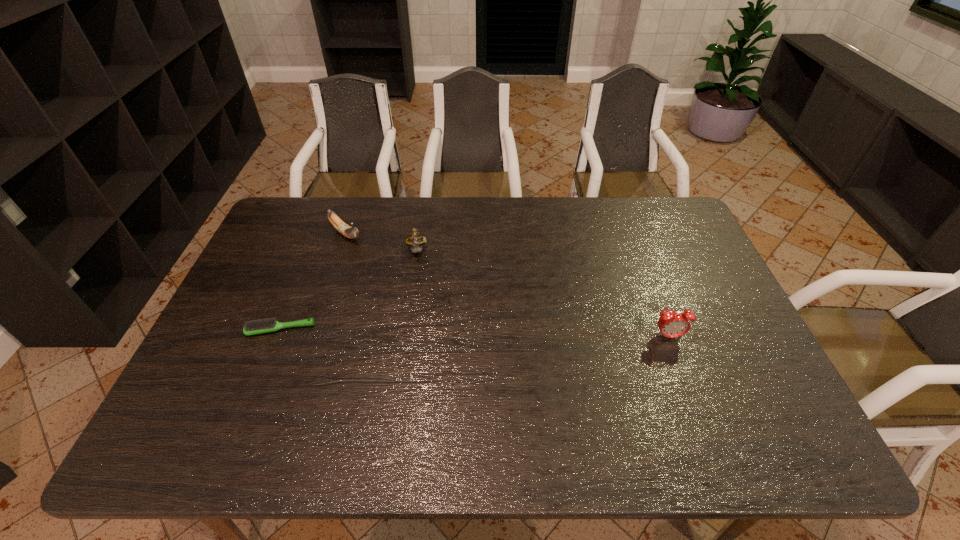
Image resolution: width=960 pixels, height=540 pixels. In order to click on free space on the desktop that is between the shortest object and the rightmost object and is positioned on the face of the third object from left to right in this screenshot , I will do `click(424, 332)`.

You are a GUI agent. You are given a task and a screenshot of the screen. Output one action in this format:
    pyautogui.click(x=<x>, y=<y>)
    Task: Click on the vacant space on the desktop that is between the hairbrush and the rightmost object and is positioned on the peel of the second shortest object
    The height and width of the screenshot is (540, 960).
    Given the screenshot: What is the action you would take?
    pyautogui.click(x=460, y=333)